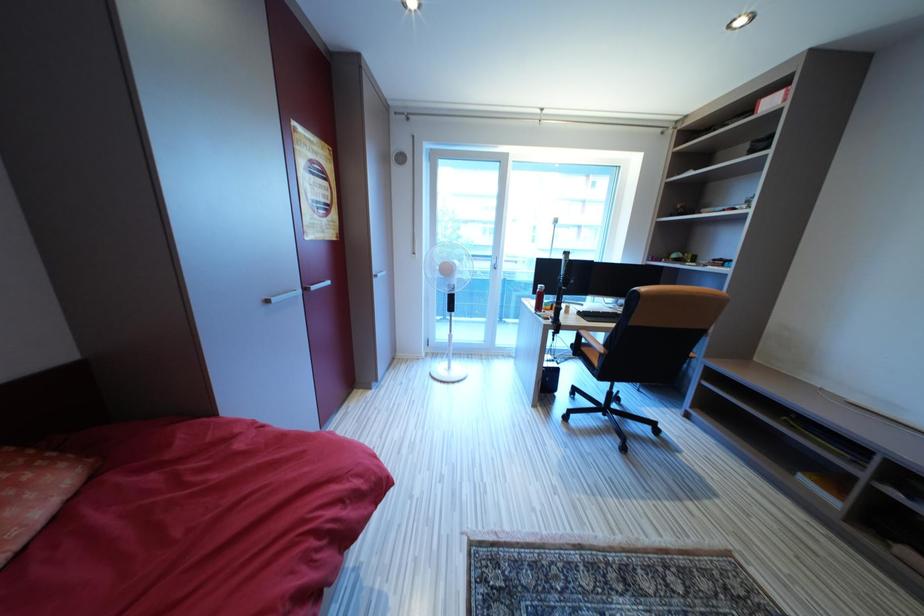
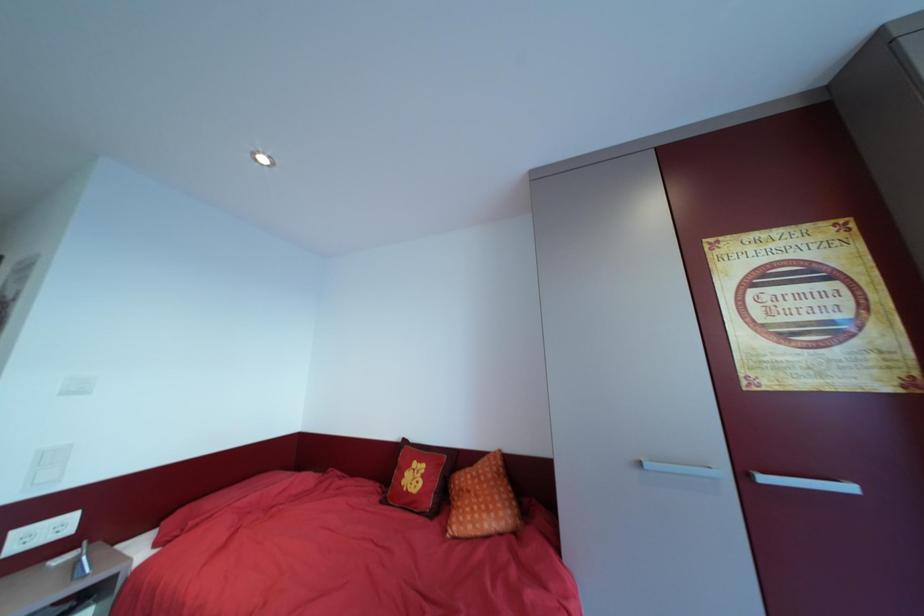
Question: The camera is either moving clockwise (left) or counter-clockwise (right) around the object. The first image is from the beginning of the video and the second image is from the end. Is the camera moving left or right when shooting the video?

Choices:
 (A) Left
 (B) Right

Answer: (B)